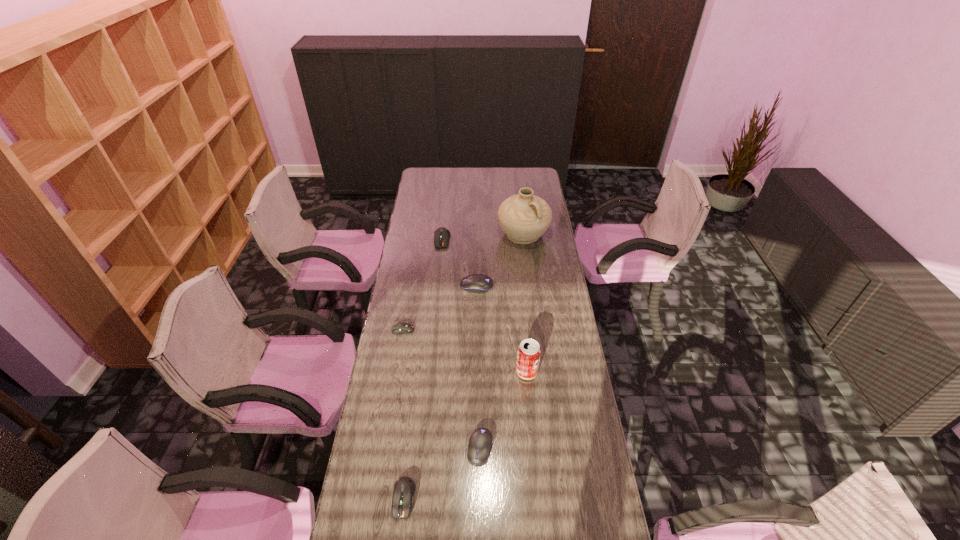
The width and height of the screenshot is (960, 540). I want to click on pottery, so click(x=524, y=217).

Locate an element on the screen. This screenshot has height=540, width=960. the sixth shortest object is located at coordinates (529, 352).

You are a GUI agent. You are given a task and a screenshot of the screen. Output one action in this format:
    pyautogui.click(x=<x>, y=<y>)
    Task: Click on the fifth farthest object
    
    Given the screenshot: What is the action you would take?
    pyautogui.click(x=529, y=352)

You are a GUI agent. You are given a task and a screenshot of the screen. Output one action in this format:
    pyautogui.click(x=<x>, y=<y>)
    Task: Click on the biggest dark computer equipment
    This screenshot has width=960, height=540.
    Given the screenshot: What is the action you would take?
    pyautogui.click(x=441, y=236)

Where is `the farthest dark computer equipment`? This screenshot has width=960, height=540. the farthest dark computer equipment is located at coordinates click(x=441, y=236).

The image size is (960, 540). I want to click on the fourth nearest computer equipment, so click(x=478, y=283).

This screenshot has height=540, width=960. I want to click on the farther black computer mouse, so 478,283.

Identify the location of the second biggest dark computer equipment. (404, 488).

Where is `the nearest object`? This screenshot has height=540, width=960. the nearest object is located at coordinates (404, 488).

Identify the location of the sixth farthest object. (480, 442).